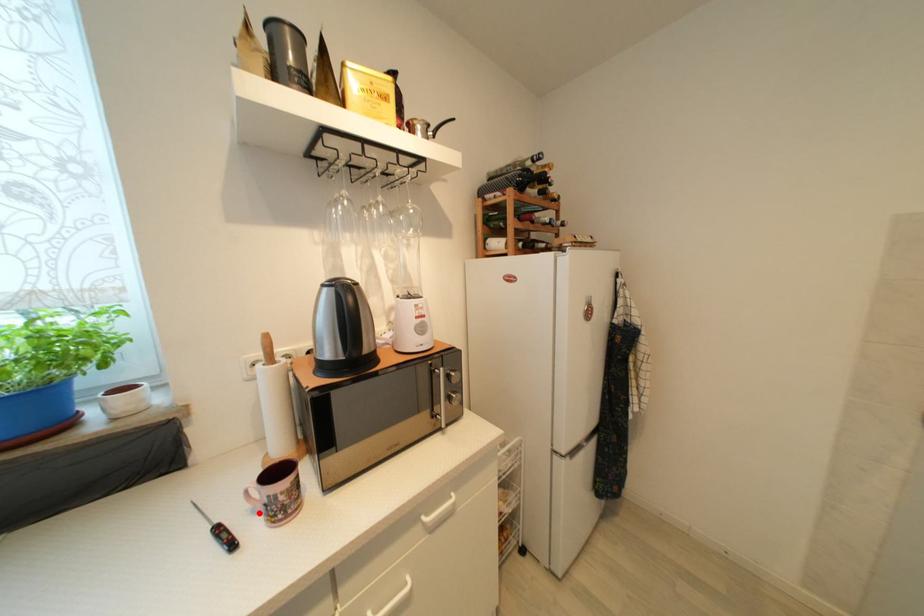
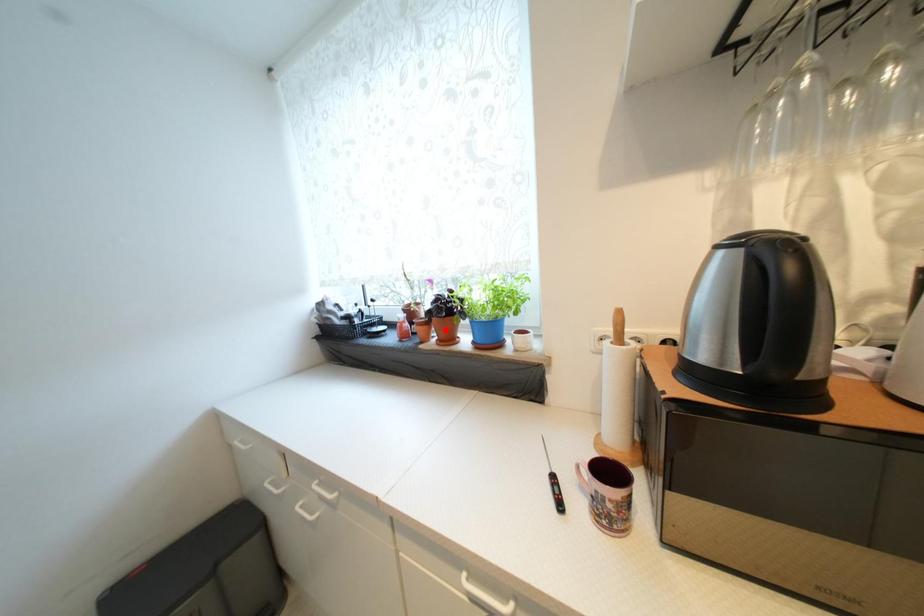
I am providing you with two images of the same scene from different viewpoints. A red point is marked on the first image and another point is marked on the second image. Do the highlighted points in image1 and image2 indicate the same real-world spot?

No